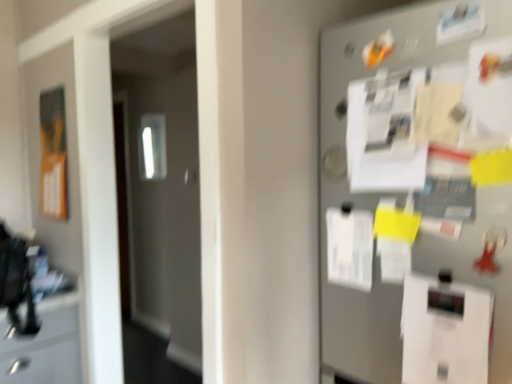
Question: Is orange matte poster at left bigger or smaller than white paper at center, which ranks as the 1th paper in right-to-left order?

Choices:
 (A) small
 (B) big

Answer: (B)

Question: From the image's perspective, is orange matte poster at left above or below white paper at center, the second paper in the top-to-bottom sequence?

Choices:
 (A) below
 (B) above

Answer: (B)

Question: Which of these objects is positioned closest to the orange matte poster at left?

Choices:
 (A) white paper at center, which ranks as the 1th paper in right-to-left order
 (B) metallic gray fridge at right
 (C) transparent glass door at left
 (D) white paper at center, which ranks as the second paper in bottom-to-top order

Answer: (C)

Question: Considering the real-world distances, which object is closest to the white paper at center, the 1th paper positioned from the back?

Choices:
 (A) white paper at center, the second paper in the top-to-bottom sequence
 (B) orange matte poster at left
 (C) transparent glass door at left
 (D) metallic gray fridge at right

Answer: (D)